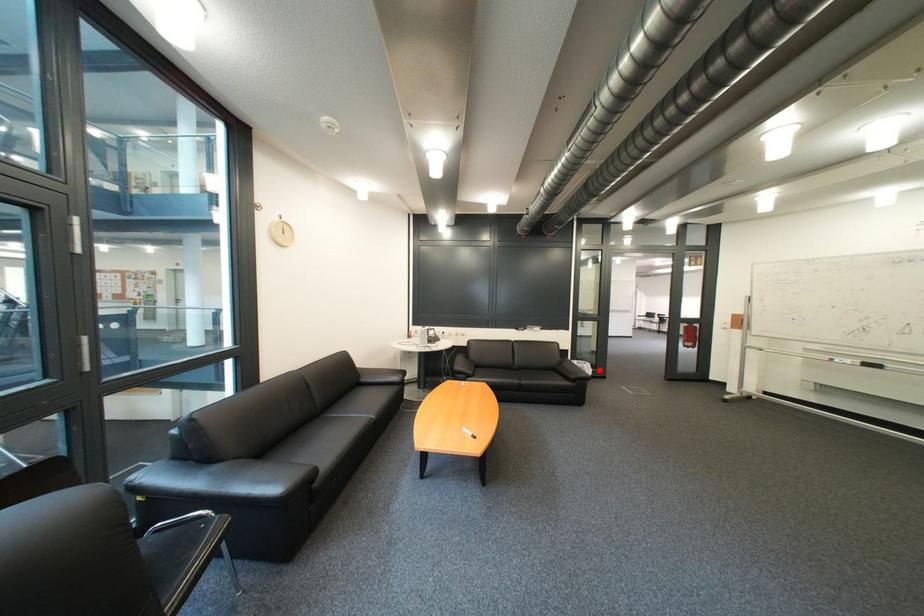
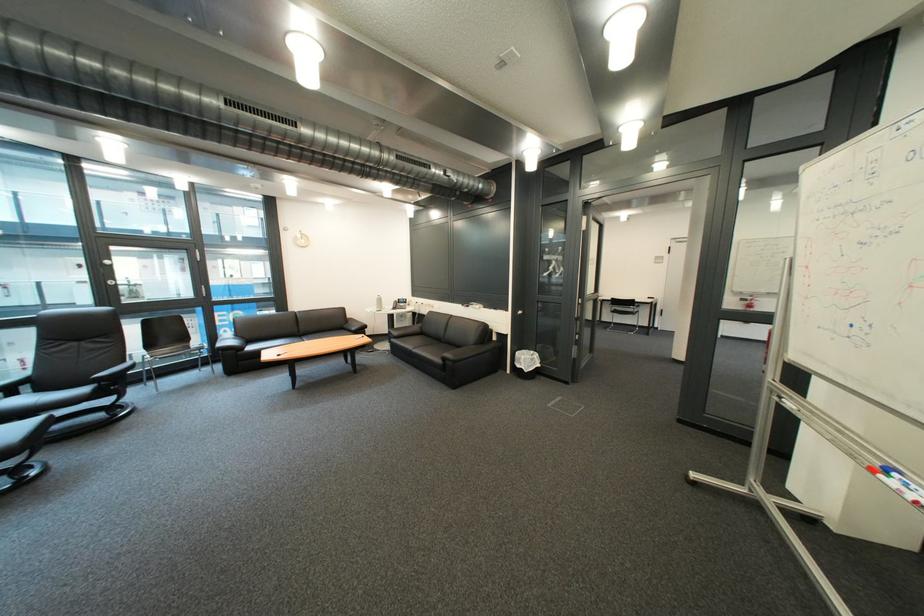
Locate, in the second image, the point that corresponds to the highlighted location in the first image.

(536, 363)